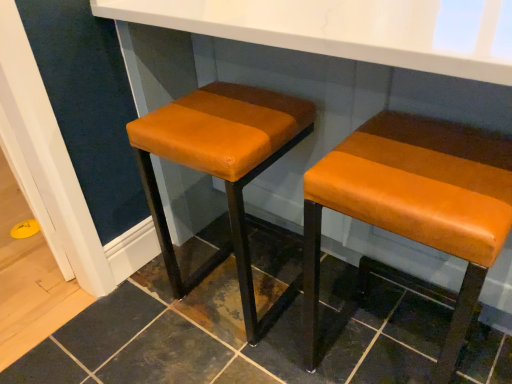
Question: From a real-world perspective, does orange leather stool at center, the 2th stool from the right, sit lower than orange leather stool at right, the 2th stool from the left?

Choices:
 (A) yes
 (B) no

Answer: (A)

Question: From the image's perspective, is orange leather stool at center, the 2th stool from the right, located beneath orange leather stool at right, the 1th stool in the right-to-left sequence?

Choices:
 (A) no
 (B) yes

Answer: (A)

Question: Does orange leather stool at center, which appears as the first stool when viewed from the left, appear on the right side of orange leather stool at right, the 2th stool from the left?

Choices:
 (A) no
 (B) yes

Answer: (A)

Question: Is orange leather stool at center, the 2th stool from the right, positioned far away from orange leather stool at right, the 1th stool in the right-to-left sequence?

Choices:
 (A) no
 (B) yes

Answer: (A)

Question: Is orange leather stool at center, the 2th stool from the right, beside orange leather stool at right, the 2th stool from the left?

Choices:
 (A) yes
 (B) no

Answer: (B)

Question: Is orange leather stool at center, the 2th stool from the right, to the left of orange leather stool at right, the 2th stool from the left, from the viewer's perspective?

Choices:
 (A) yes
 (B) no

Answer: (A)

Question: Is orange leather stool at right, the 1th stool in the right-to-left sequence, next to orange leather stool at center, the 2th stool from the right, and touching it?

Choices:
 (A) yes
 (B) no

Answer: (B)

Question: Would you say orange leather stool at right, the 2th stool from the left, contains orange leather stool at center, which appears as the first stool when viewed from the left?

Choices:
 (A) no
 (B) yes

Answer: (A)

Question: From a real-world perspective, is orange leather stool at right, the 2th stool from the left, on orange leather stool at center, the 2th stool from the right?

Choices:
 (A) yes
 (B) no

Answer: (A)

Question: Does orange leather stool at right, the 2th stool from the left, turn towards orange leather stool at center, the 2th stool from the right?

Choices:
 (A) no
 (B) yes

Answer: (A)

Question: Is orange leather stool at right, the 2th stool from the left, completely or partially outside of orange leather stool at center, the 2th stool from the right?

Choices:
 (A) yes
 (B) no

Answer: (A)

Question: From the image's perspective, does orange leather stool at right, the 2th stool from the left, appear lower than orange leather stool at center, the 2th stool from the right?

Choices:
 (A) no
 (B) yes

Answer: (B)

Question: In terms of width, does orange leather stool at center, the 2th stool from the right, look wider or thinner when compared to orange leather stool at right, the 2th stool from the left?

Choices:
 (A) thin
 (B) wide

Answer: (A)